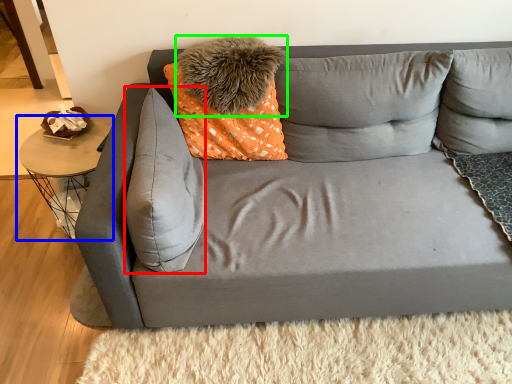
Question: Which object is the closest to the pillow (highlighted by a red box)? Choose among these: table (highlighted by a blue box) or pillow (highlighted by a green box).

Choices:
 (A) table
 (B) pillow

Answer: (B)